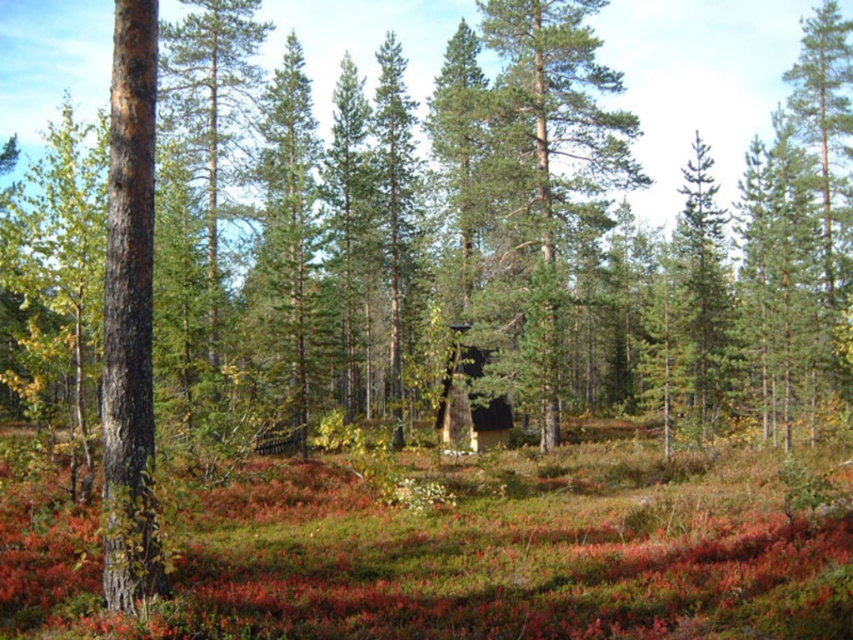
Is smooth brown bark at left closer to the viewer compared to green textured pine tree at center?

Yes, smooth brown bark at left is closer to the viewer.

Is smooth brown bark at left below green textured pine tree at center?

Yes, smooth brown bark at left is below green textured pine tree at center.

In order to click on smooth brown bark at left in this screenshot , I will do `click(131, 316)`.

Between point (279, 220) and point (398, 163), which one is positioned in front?

Point (279, 220) is in front.

Is green textured pine tree at center further to the viewer compared to green matte tree at center?

No.

Is point (292, 58) farther from viewer compared to point (404, 145)?

That is True.

I want to click on green textured pine tree at center, so [x=289, y=228].

Does green needle-like at center appear under green matte tree at center?

No, green needle-like at center is not below green matte tree at center.

Which is behind, point (589, 1) or point (393, 332)?

Positioned behind is point (393, 332).

Image resolution: width=853 pixels, height=640 pixels. I want to click on green needle-like at center, so click(556, 140).